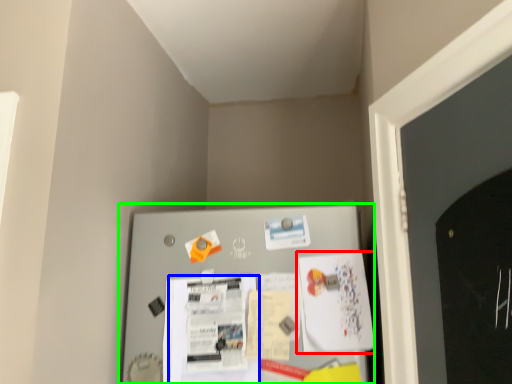
Question: Estimate the real-world distances between objects in this image. Which object is closer to poster (highlighted by a red box), poster (highlighted by a blue box) or bulletin board (highlighted by a green box)?

Choices:
 (A) poster
 (B) bulletin board

Answer: (B)